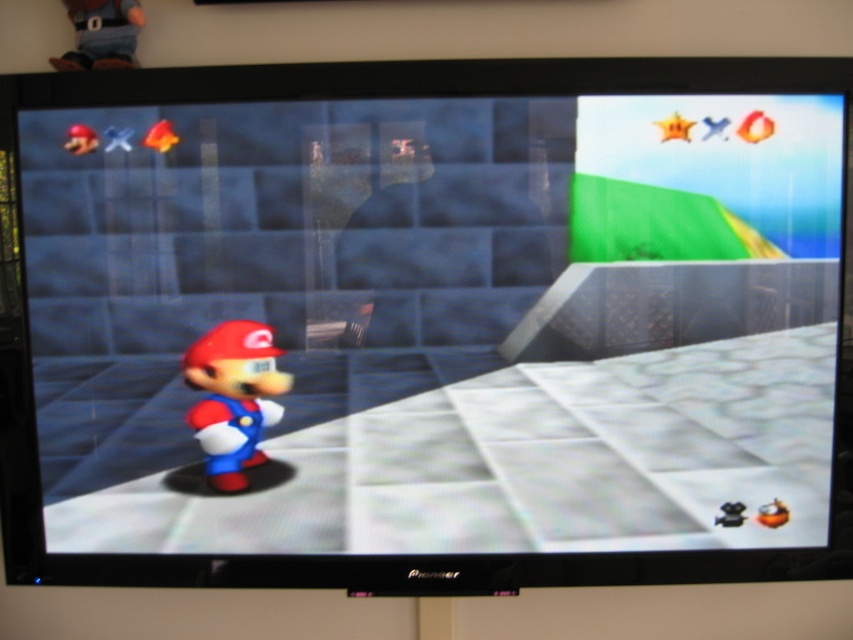
Question: Does matte plastic mario at center appear on the left side of denim jeans at upper left?

Choices:
 (A) no
 (B) yes

Answer: (A)

Question: From the image, what is the correct spatial relationship of denim jeans at upper left in relation to shiny red star at upper left?

Choices:
 (A) left
 (B) right

Answer: (B)

Question: Among these objects, which one is nearest to the camera?

Choices:
 (A) matte plastic mario at center
 (B) smooth matte mario at center
 (C) shiny red star at upper left

Answer: (B)

Question: Estimate the real-world distances between objects in this image. Which object is closer to the smooth matte mario at center?

Choices:
 (A) matte plastic mario at center
 (B) orange matte coin at bottom right
 (C) shiny red star at upper left
 (D) denim jeans at upper left

Answer: (A)

Question: Observing the image, what is the correct spatial positioning of smooth matte mario at center in reference to shiny red star at upper left?

Choices:
 (A) above
 (B) below

Answer: (B)

Question: Which point is farther from the camera taking this photo?

Choices:
 (A) (289, 372)
 (B) (772, 506)
 (C) (93, 141)
 (D) (252, 138)

Answer: (A)